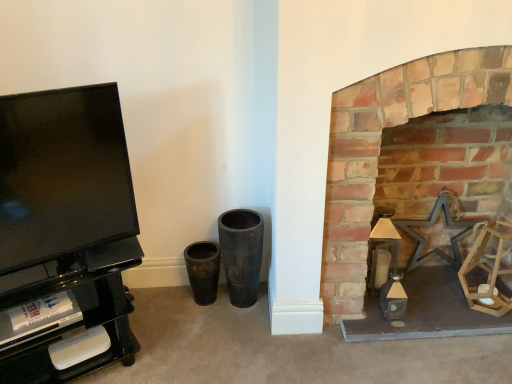
Question: Considering the relative sizes of brick fireplace at right and black glossy tv stand at left in the image provided, is brick fireplace at right smaller than black glossy tv stand at left?

Choices:
 (A) yes
 (B) no

Answer: (B)

Question: Is brick fireplace at right positioned in front of black glossy tv stand at left?

Choices:
 (A) no
 (B) yes

Answer: (A)

Question: From the image's perspective, does brick fireplace at right appear lower than black glossy tv stand at left?

Choices:
 (A) yes
 (B) no

Answer: (B)

Question: Is brick fireplace at right taller than black glossy tv stand at left?

Choices:
 (A) yes
 (B) no

Answer: (A)

Question: Can you confirm if brick fireplace at right is positioned to the right of black glossy tv stand at left?

Choices:
 (A) yes
 (B) no

Answer: (A)

Question: Can black glossy tv stand at left be found inside brick fireplace at right?

Choices:
 (A) no
 (B) yes

Answer: (A)

Question: Is the depth of black glossy tv stand at left less than that of brick fireplace at right?

Choices:
 (A) yes
 (B) no

Answer: (A)

Question: Does black glossy tv stand at left have a lesser width compared to brick fireplace at right?

Choices:
 (A) yes
 (B) no

Answer: (A)

Question: Can you confirm if black glossy tv stand at left is positioned to the left of brick fireplace at right?

Choices:
 (A) no
 (B) yes

Answer: (B)

Question: From a real-world perspective, is black glossy tv stand at left positioned under brick fireplace at right based on gravity?

Choices:
 (A) yes
 (B) no

Answer: (B)

Question: From the image's perspective, is black glossy tv stand at left located beneath brick fireplace at right?

Choices:
 (A) no
 (B) yes

Answer: (B)

Question: Is black glossy tv stand at left taller than brick fireplace at right?

Choices:
 (A) no
 (B) yes

Answer: (A)

Question: Looking at the image, does black glossy tv stand at left seem bigger or smaller compared to brick fireplace at right?

Choices:
 (A) small
 (B) big

Answer: (A)